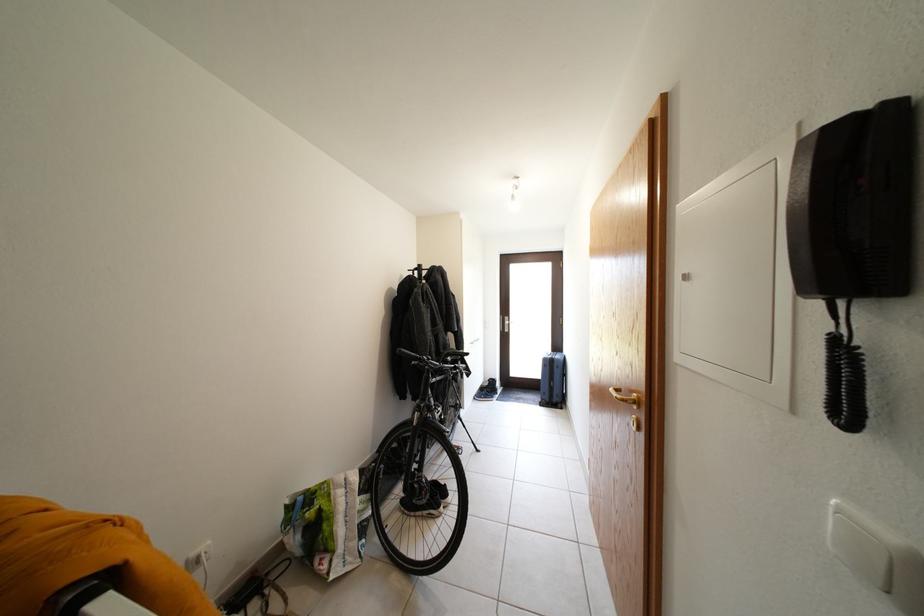
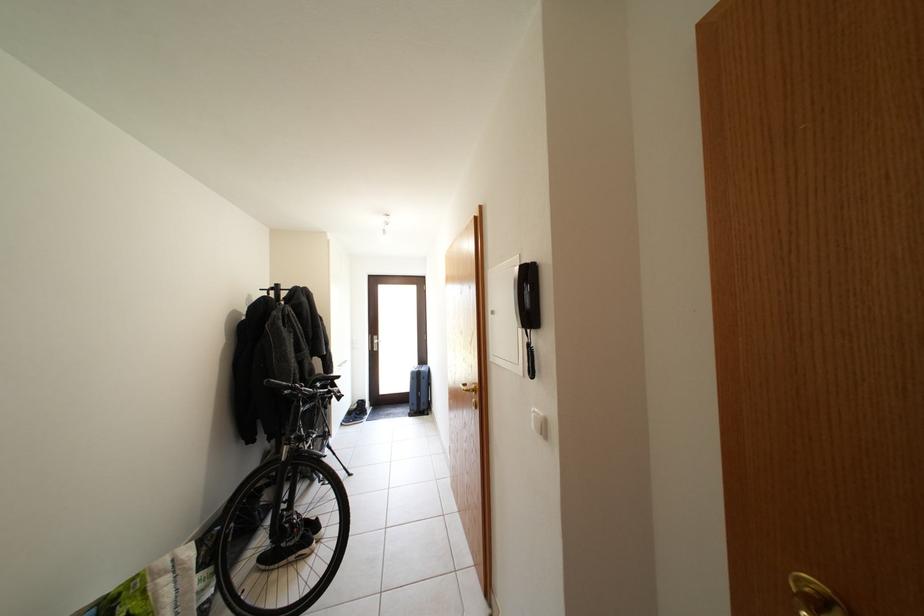
Locate, in the second image, the point that corresponds to point (878, 111) in the first image.

(537, 267)